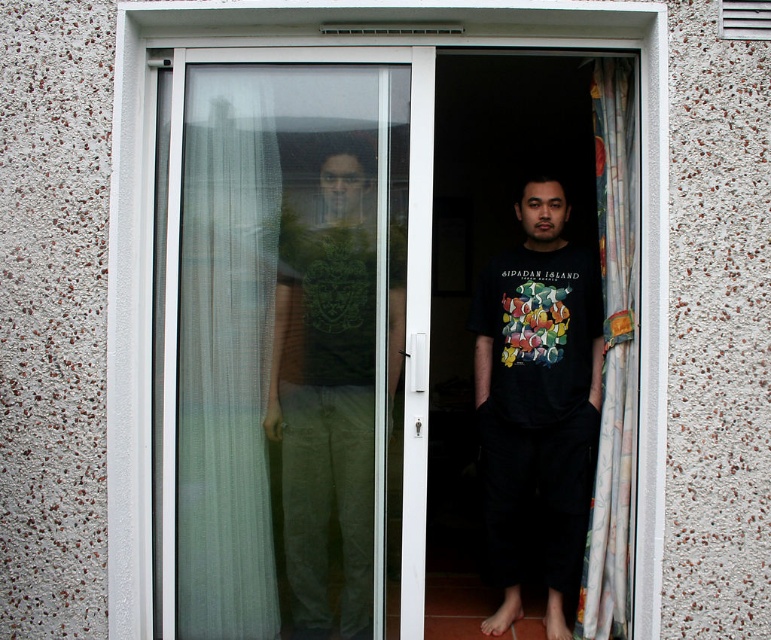
Question: Is transparent plastic screen door at center thinner than translucent fabric curtain at left?

Choices:
 (A) yes
 (B) no

Answer: (B)

Question: Which point is farther to the camera?

Choices:
 (A) (588, 358)
 (B) (359, 166)
 (C) (601, 163)
 (D) (130, 244)

Answer: (A)

Question: Which point is closer to the camera?

Choices:
 (A) pos(635,376)
 (B) pos(509,29)

Answer: (B)

Question: Is transparent plastic screen door at center above black cotton t-shirt at center?

Choices:
 (A) no
 (B) yes

Answer: (B)

Question: Which object is positioned farthest from the black cotton t-shirt at center?

Choices:
 (A) transparent glass door at center
 (B) floral fabric curtain at right
 (C) green matte t-shirt at center

Answer: (A)

Question: Does green matte t-shirt at center appear over floral fabric curtain at right?

Choices:
 (A) yes
 (B) no

Answer: (B)